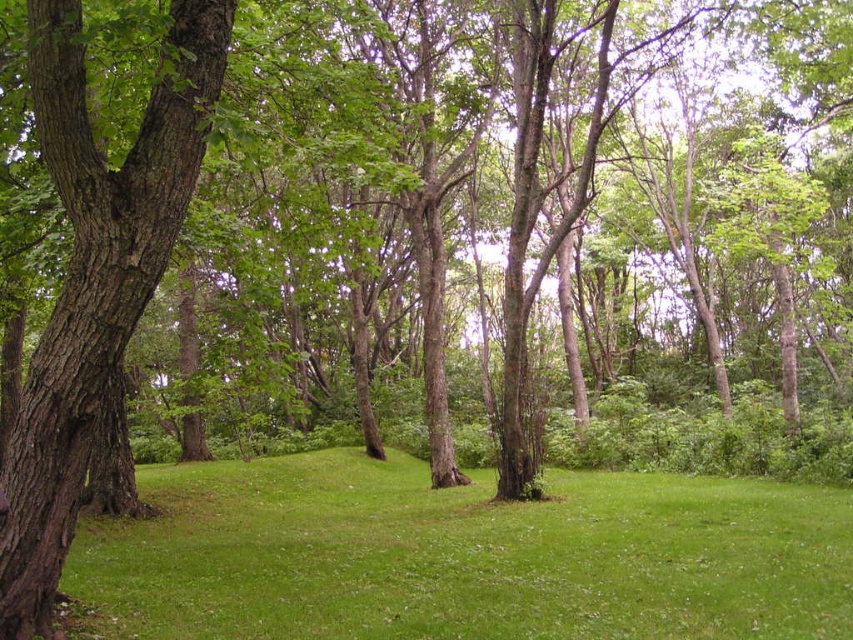
You are planning to set up a picnic blanket in the forest clearing. The picnic blanket is 2 meters wide. Considering the green grassy at center and the brown rough bark tree at left, which area can accommodate the blanket without overlapping the tree?

The green grassy at center has a width greater than the brown rough bark tree at left, so placing the picnic blanket on the green grassy at center would accommodate the 2 meter width without overlapping the tree.

You are standing in the forest clearing and want to take a photo of the green grassy at center and the brown rough bark tree at left. Which object is closer to the camera?

The green grassy at center is closer to the camera because it is positioned below the brown rough bark tree at left, indicating it is in the foreground.